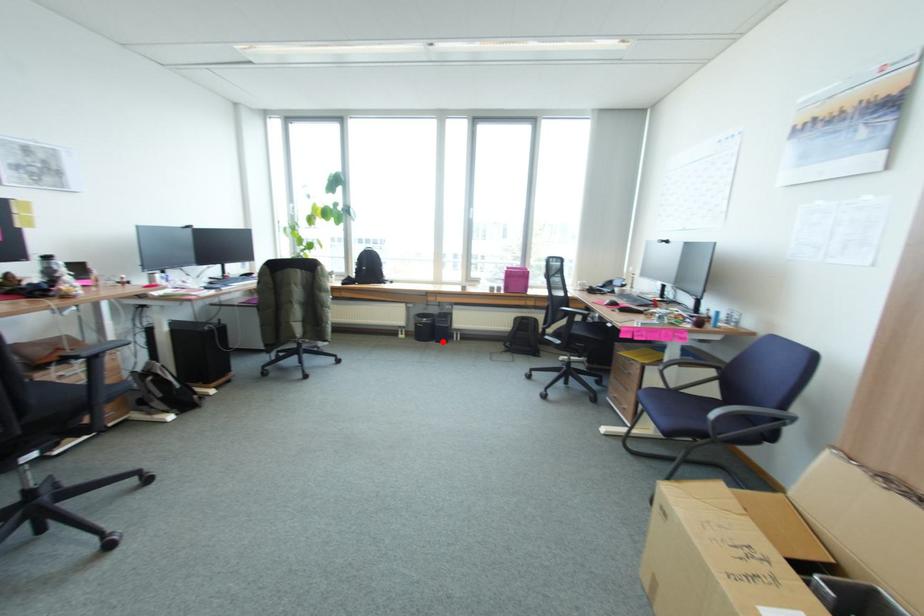
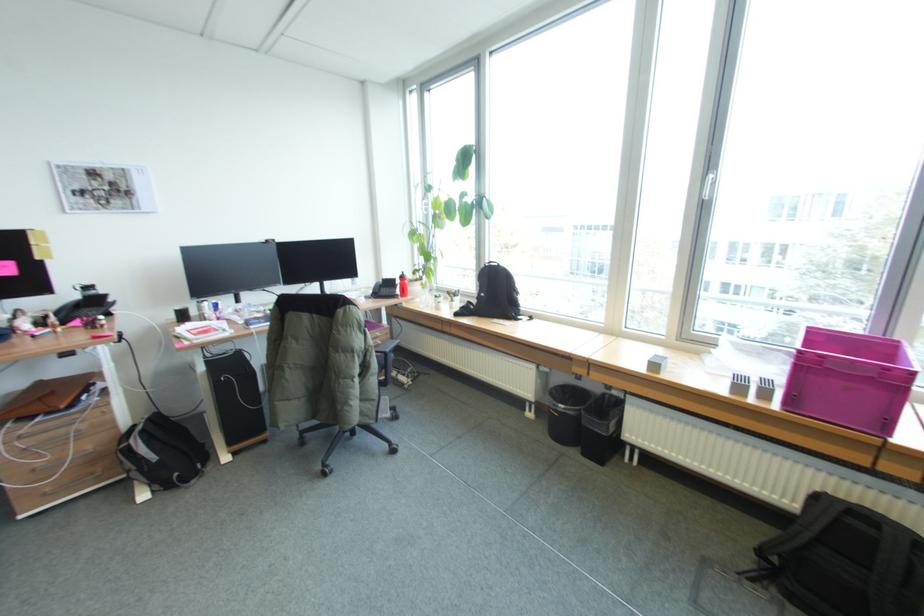
Question: I am providing you with two images of the same scene from different viewpoints. A red point is marked on the first image. Can you still see the location of the red point in image 2?

Choices:
 (A) Yes
 (B) No

Answer: (A)